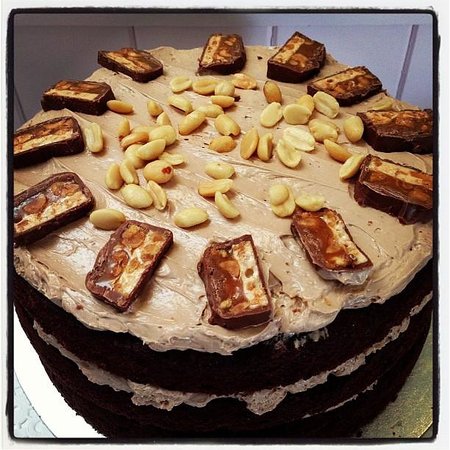
This screenshot has height=450, width=450. In order to click on silver cake plate in lower right corner in this screenshot , I will do `click(411, 414)`.